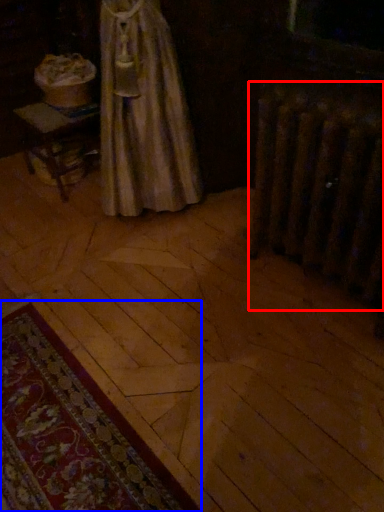
Question: Which of the following is the closest to the observer, radiator (highlighted by a red box) or mat (highlighted by a blue box)?

Choices:
 (A) radiator
 (B) mat

Answer: (B)